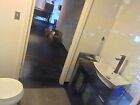
The width and height of the screenshot is (140, 105). What are the coordinates of `left cabinet door` in the screenshot? It's located at (80, 81).